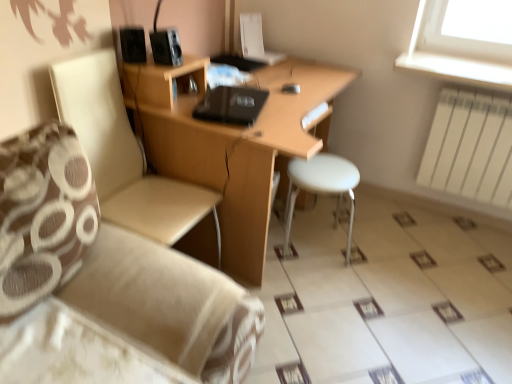
Question: From the image's perspective, is black matte speaker at upper left, acting as the first speaker starting from the left, located beneath white plastic stool at center?

Choices:
 (A) yes
 (B) no

Answer: (B)

Question: From a real-world perspective, is black matte speaker at upper left, which is the 2th speaker in right-to-left order, physically below white plastic stool at center?

Choices:
 (A) no
 (B) yes

Answer: (A)

Question: Considering the relative sizes of black matte speaker at upper left, which is the 2th speaker in right-to-left order, and white plastic stool at center in the image provided, is black matte speaker at upper left, which is the 2th speaker in right-to-left order, thinner than white plastic stool at center?

Choices:
 (A) no
 (B) yes

Answer: (B)

Question: Considering the relative sizes of black matte speaker at upper left, which is the 2th speaker in right-to-left order, and white plastic stool at center in the image provided, is black matte speaker at upper left, which is the 2th speaker in right-to-left order, smaller than white plastic stool at center?

Choices:
 (A) no
 (B) yes

Answer: (B)

Question: Is black matte speaker at upper left, acting as the first speaker starting from the left, outside white plastic stool at center?

Choices:
 (A) no
 (B) yes

Answer: (B)

Question: Considering the positions of black matte laptop at center and white plastic stool at center in the image, is black matte laptop at center taller or shorter than white plastic stool at center?

Choices:
 (A) short
 (B) tall

Answer: (A)

Question: From the image's perspective, is black matte laptop at center located above or below white plastic stool at center?

Choices:
 (A) below
 (B) above

Answer: (B)

Question: Is point (223, 114) closer or farther from the camera than point (318, 185)?

Choices:
 (A) closer
 (B) farther

Answer: (A)

Question: Considering the positions of black matte laptop at center and white plastic stool at center in the image, is black matte laptop at center wider or thinner than white plastic stool at center?

Choices:
 (A) wide
 (B) thin

Answer: (B)

Question: In terms of size, does black matte speaker at upper left, which is the 2th speaker in right-to-left order, appear bigger or smaller than black plastic speaker at upper center, which appears as the 2th speaker when viewed from the left?

Choices:
 (A) small
 (B) big

Answer: (B)

Question: From the image's perspective, is black matte speaker at upper left, acting as the first speaker starting from the left, positioned above or below black plastic speaker at upper center, which appears as the 2th speaker when viewed from the left?

Choices:
 (A) above
 (B) below

Answer: (A)

Question: Is point (133, 41) closer or farther from the camera than point (155, 33)?

Choices:
 (A) farther
 (B) closer

Answer: (B)

Question: In the image, is black matte speaker at upper left, which is the 2th speaker in right-to-left order, on the left side or the right side of black plastic speaker at upper center, which appears as the 2th speaker when viewed from the left?

Choices:
 (A) right
 (B) left

Answer: (B)

Question: Is black matte speaker at upper left, which is the 2th speaker in right-to-left order, taller or shorter than wooden desk at center?

Choices:
 (A) short
 (B) tall

Answer: (A)

Question: Is black matte speaker at upper left, acting as the first speaker starting from the left, inside the boundaries of wooden desk at center, or outside?

Choices:
 (A) inside
 (B) outside

Answer: (B)